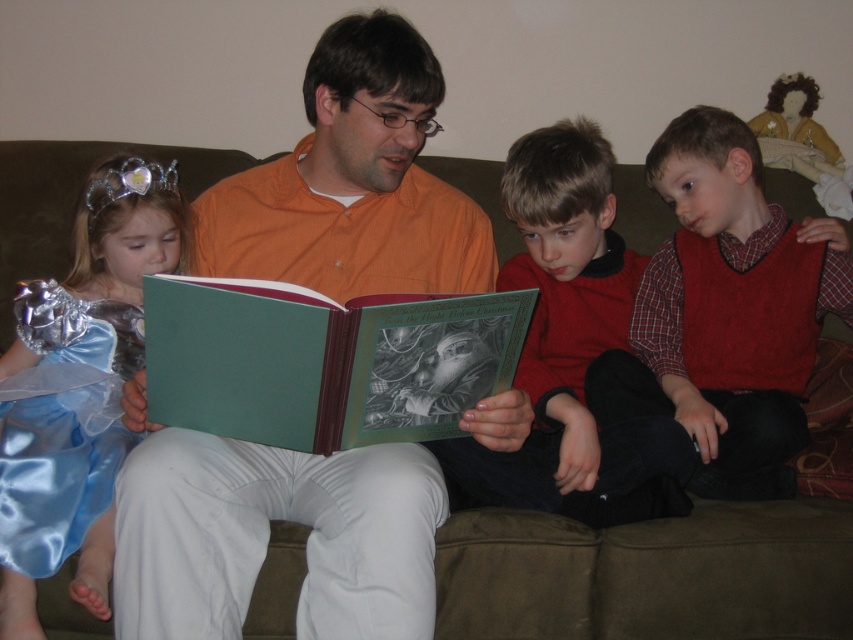
Question: Does orange shirt at center appear on the left side of red flannel shirt at right?

Choices:
 (A) no
 (B) yes

Answer: (B)

Question: Among these points, which one is farthest from the camera?

Choices:
 (A) (625, 508)
 (B) (682, 284)
 (C) (109, 280)
 (D) (169, 348)

Answer: (B)

Question: Is red flannel shirt at right below matte green book at center?

Choices:
 (A) no
 (B) yes

Answer: (A)

Question: Which object is closer to the camera taking this photo?

Choices:
 (A) blue satin dress at left
 (B) green matte book at center
 (C) red flannel shirt at right

Answer: (B)

Question: Estimate the real-world distances between objects in this image. Which object is closer to the red flannel shirt at right?

Choices:
 (A) matte green book at center
 (B) orange shirt at center

Answer: (A)

Question: Considering the relative positions of matte green book at center and satin blue dress at left in the image provided, where is matte green book at center located with respect to satin blue dress at left?

Choices:
 (A) right
 (B) left

Answer: (A)